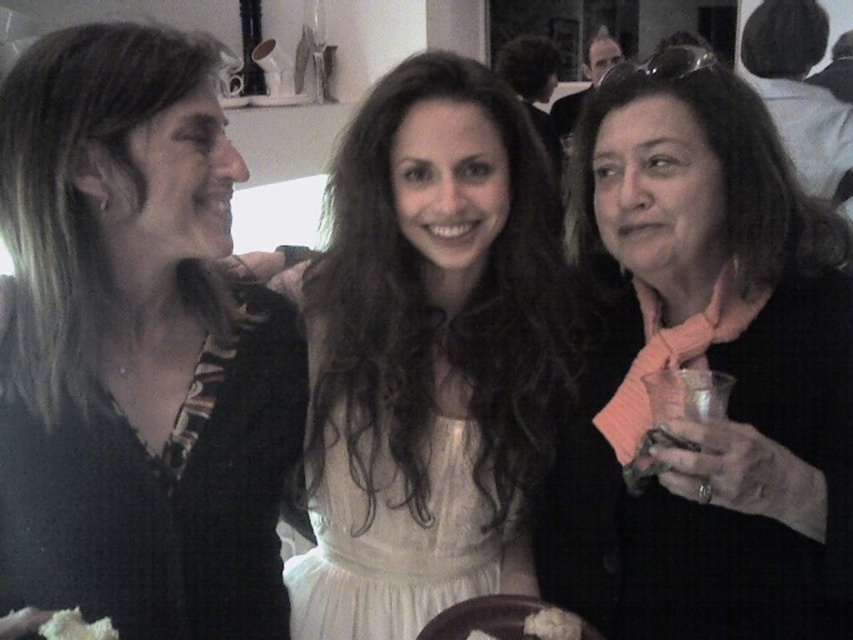
Does black matte shirt at left appear under white fluffy bread at lower center?

Actually, black matte shirt at left is above white fluffy bread at lower center.

Find the location of `black matte shirt at left`. black matte shirt at left is located at coordinates (138, 348).

Who is more distant from viewer, (x=843, y=285) or (x=526, y=627)?

Positioned behind is point (x=843, y=285).

Does pink fabric scarf at right appear over white fluffy bread at lower center?

Yes.

I want to click on pink fabric scarf at right, so click(x=701, y=368).

Is pink fabric scarf at right smaller than white crumbly food at lower left?

No, pink fabric scarf at right is not smaller than white crumbly food at lower left.

Is point (743, 90) less distant than point (90, 636)?

No, (743, 90) is further to viewer.

Where is `pink fabric scarf at right`? This screenshot has width=853, height=640. pink fabric scarf at right is located at coordinates (701, 368).

Identify the location of pink fabric scarf at right. The height and width of the screenshot is (640, 853). (701, 368).